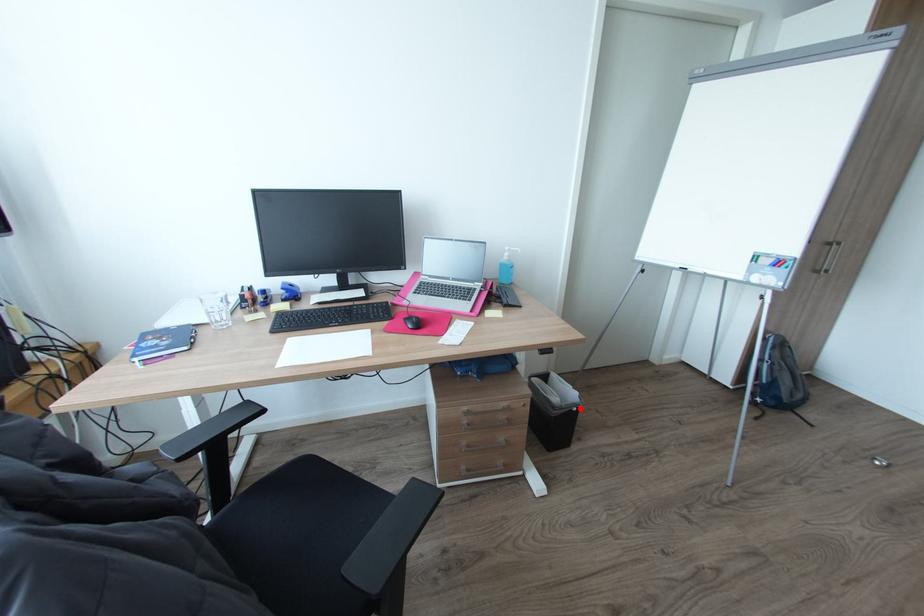
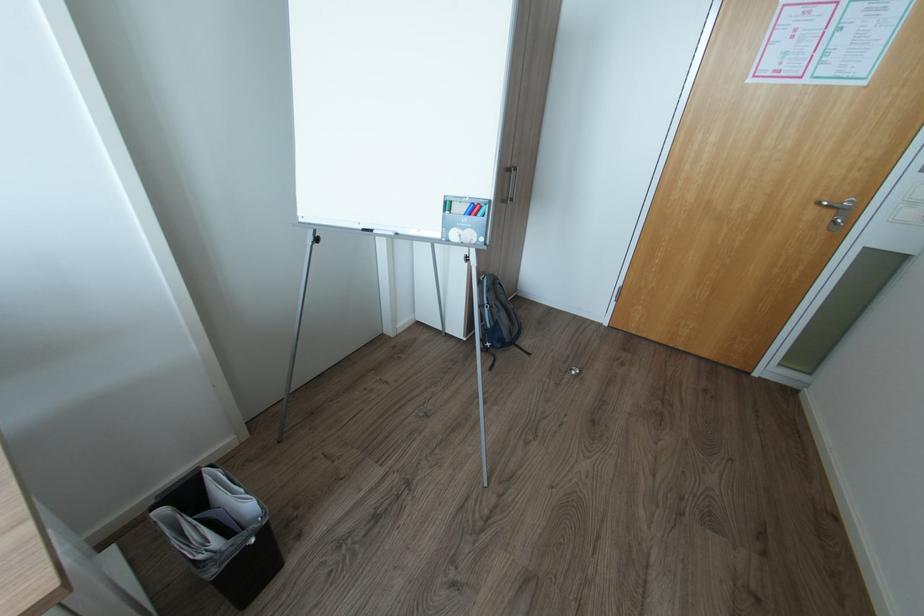
Find the pixel in the second image that matches the highlighted location in the first image.

(257, 541)